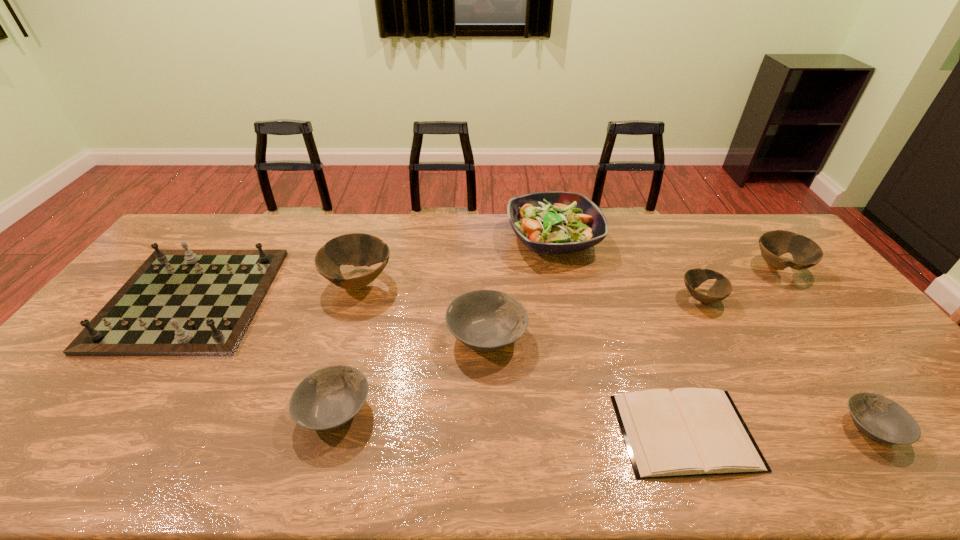
This screenshot has width=960, height=540. I want to click on vacant space located on the front of the smallest brown bowl, so click(x=724, y=340).

Locate an element on the screen. This screenshot has width=960, height=540. free space located 0.110m on the right of the second smallest gray bowl is located at coordinates 418,410.

Where is `free location located on the right of the smallest gray bowl`? The width and height of the screenshot is (960, 540). free location located on the right of the smallest gray bowl is located at coordinates (943, 428).

At what (x,y) coordinates should I click in order to perform the action: click on vacant region located 0.090m on the right of the shortest object. Please return your answer as a coordinate pair (x, y). The height and width of the screenshot is (540, 960). Looking at the image, I should click on (790, 432).

This screenshot has height=540, width=960. Find the location of `salad plate positioned at the far edge`. salad plate positioned at the far edge is located at coordinates (553, 222).

The width and height of the screenshot is (960, 540). Identify the location of bowl present at the far edge. (806, 253).

Where is `hardback book that is at the near edge`? The width and height of the screenshot is (960, 540). hardback book that is at the near edge is located at coordinates (686, 432).

Locate an element on the screen. object at the left edge is located at coordinates (186, 302).

The image size is (960, 540). I want to click on object situated at the far right corner, so click(806, 253).

Locate an element on the screen. The width and height of the screenshot is (960, 540). object positioned at the near right corner is located at coordinates (881, 419).